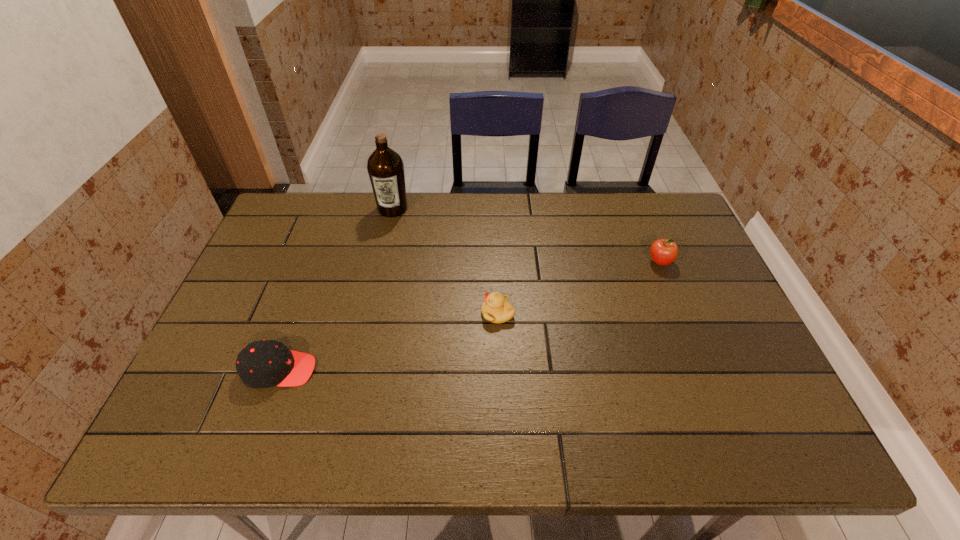
Locate an element on the screen. The height and width of the screenshot is (540, 960). the farthest object is located at coordinates (385, 167).

Identify the location of the third object from right to left. (385, 167).

Where is `the third nearest object`? the third nearest object is located at coordinates (663, 252).

What are the coordinates of `the third shortest object` in the screenshot? It's located at (663, 252).

Identify the location of the leftmost object. The height and width of the screenshot is (540, 960). (265, 363).

Identify the location of cap. This screenshot has width=960, height=540. (265, 363).

Locate an element on the screen. This screenshot has width=960, height=540. the second object from right to left is located at coordinates (496, 309).

Locate an element on the screen. The width and height of the screenshot is (960, 540). duckling is located at coordinates (496, 309).

Identify the location of vacant area situated on the label of the farthest object. The height and width of the screenshot is (540, 960). (375, 286).

At what (x,y) coordinates should I click in order to perform the action: click on vacant space located 0.230m on the left of the third nearest object. Please return your answer as a coordinate pair (x, y). Looking at the image, I should click on (568, 262).